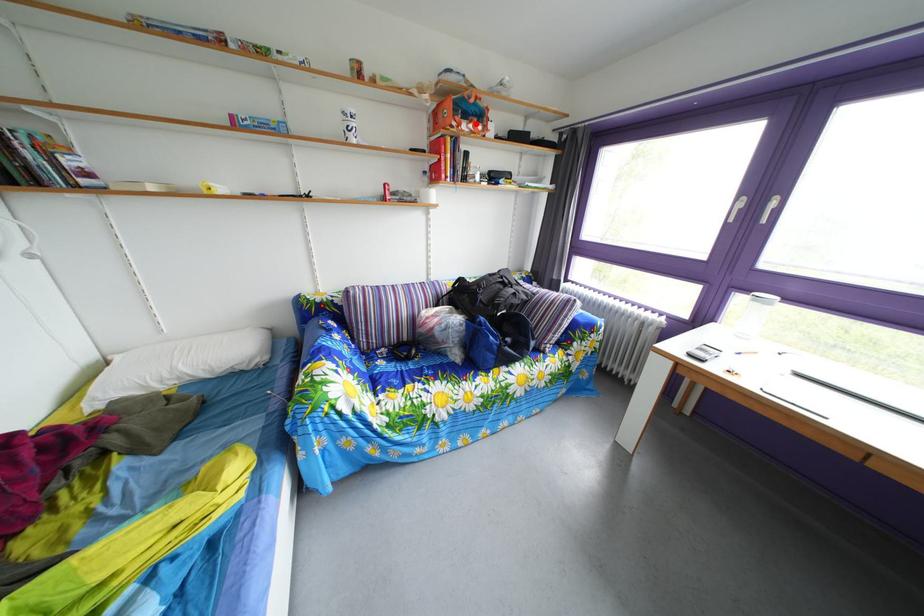
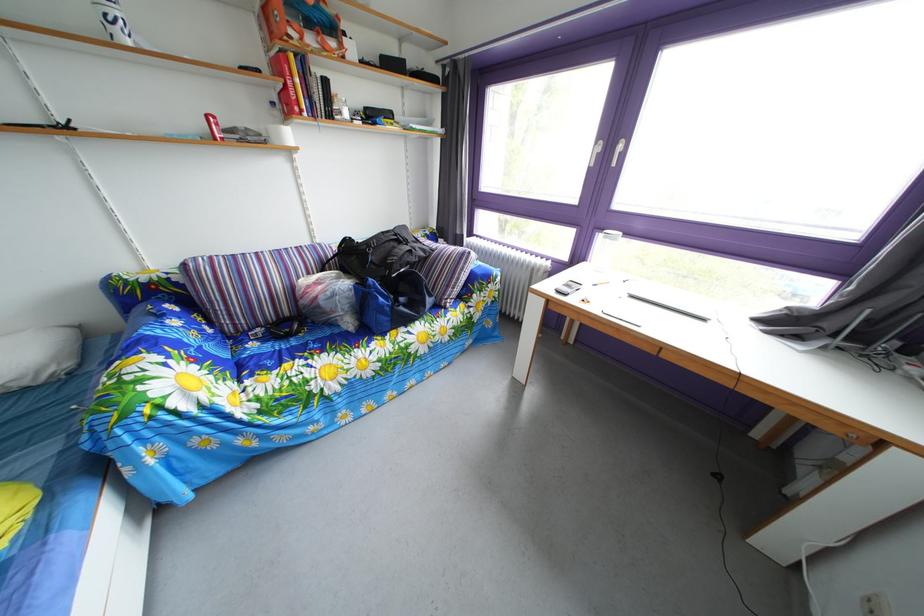
Locate, in the second image, the point that corresponds to the highlighted location in the first image.

(320, 33)